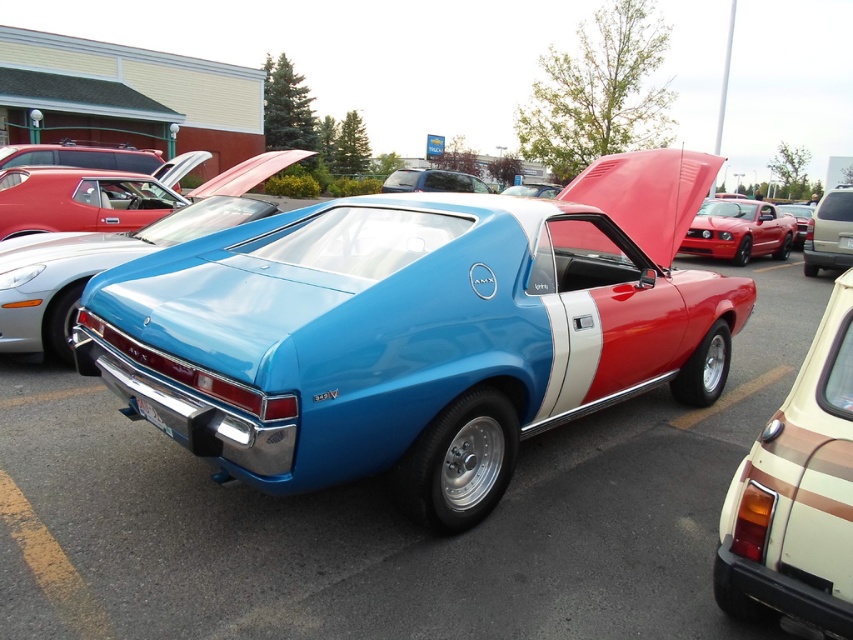
Question: Is shiny metallic car at center wider than shiny red car at center?

Choices:
 (A) yes
 (B) no

Answer: (A)

Question: Among these points, which one is nearest to the camera?

Choices:
 (A) click(171, 432)
 (B) click(146, 170)
 (C) click(662, 419)

Answer: (A)

Question: Can you confirm if glossy metallic car at center is positioned above shiny red car at upper left?

Choices:
 (A) no
 (B) yes

Answer: (A)

Question: Which point is farther to the camera?

Choices:
 (A) glossy metallic car at center
 (B) beige matte sedan at lower right

Answer: (A)

Question: Which object is farther from the camera taking this photo?

Choices:
 (A) glossy metallic car at center
 (B) matte silver suv at center

Answer: (B)

Question: Does shiny red car at upper left have a larger size compared to shiny red car at center?

Choices:
 (A) no
 (B) yes

Answer: (A)